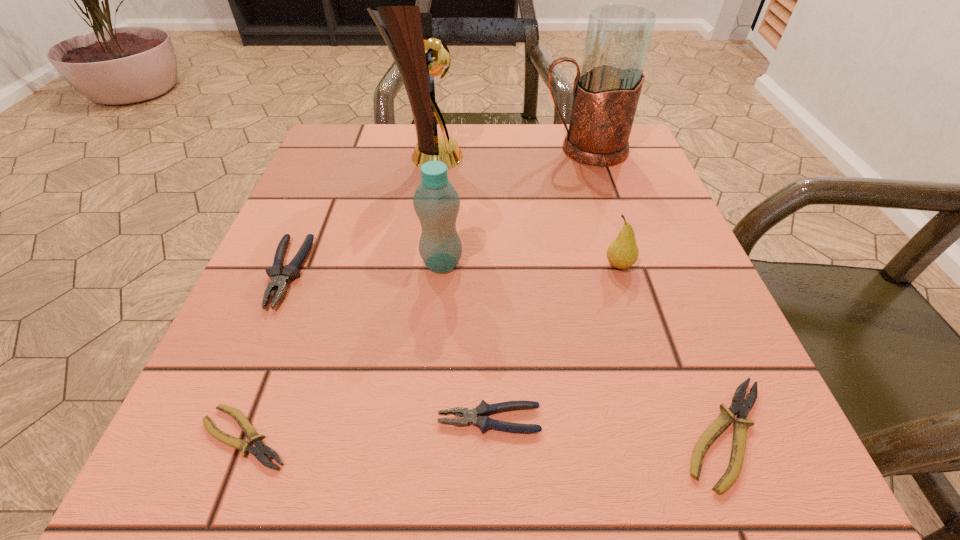
You are a GUI agent. You are given a task and a screenshot of the screen. Output one action in this format:
    pyautogui.click(x=<x>, y=<y>)
    Task: Click on the blank space at the near right corner of the desktop
    The width and height of the screenshot is (960, 540).
    Given the screenshot: What is the action you would take?
    pyautogui.click(x=666, y=448)

Locate an element on the screen. vacant space that's between the fifth shortest object and the left gray pliers is located at coordinates (453, 269).

Locate an element on the screen. vacant area that lies between the rightmost pliers and the bigger gray pliers is located at coordinates (507, 353).

You are a GUI agent. You are given a task and a screenshot of the screen. Output one action in this format:
    pyautogui.click(x=<x>, y=<y>)
    Task: Click on the unoccupied position between the pear and the smaller gray pliers
    The image size is (960, 540).
    Given the screenshot: What is the action you would take?
    pyautogui.click(x=554, y=342)

Locate an element on the screen. vacant space in between the right gray pliers and the fourth tallest object is located at coordinates (554, 342).

Identify the location of empty space that is in between the pitcher and the right yellow pliers. The image size is (960, 540). (656, 292).

I want to click on empty location between the gray pitcher and the water bottle, so click(x=513, y=206).

The width and height of the screenshot is (960, 540). I want to click on free space between the third shortest pliers and the award, so click(458, 288).

Find the location of a particular element. The image size is (960, 540). free point between the bigger yellow pliers and the smaller yellow pliers is located at coordinates (486, 435).

You are a GUI agent. You are given a task and a screenshot of the screen. Output one action in this format:
    pyautogui.click(x=<x>, y=<y>)
    Task: Click on the empty space between the right yellow pliers and the pear
    The height and width of the screenshot is (540, 960).
    Given the screenshot: What is the action you would take?
    pyautogui.click(x=672, y=349)